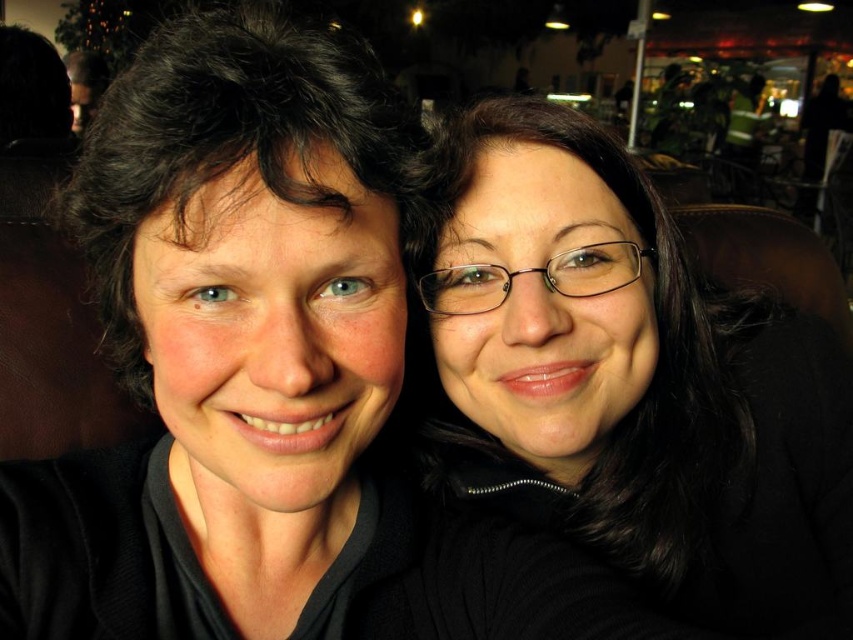
Question: Does matte black hair at left come behind black matte glasses at upper right?

Choices:
 (A) yes
 (B) no

Answer: (B)

Question: Among these points, which one is farthest from the camera?

Choices:
 (A) (250, 257)
 (B) (711, 420)

Answer: (B)

Question: Is matte black hair at left below black matte glasses at upper right?

Choices:
 (A) yes
 (B) no

Answer: (B)

Question: Does matte black hair at left appear on the right side of black matte glasses at upper right?

Choices:
 (A) yes
 (B) no

Answer: (B)